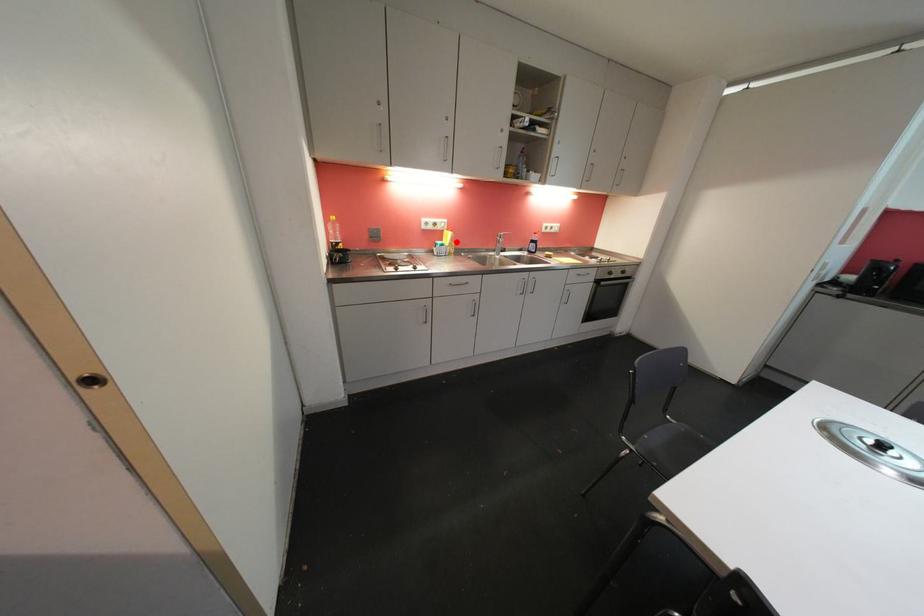
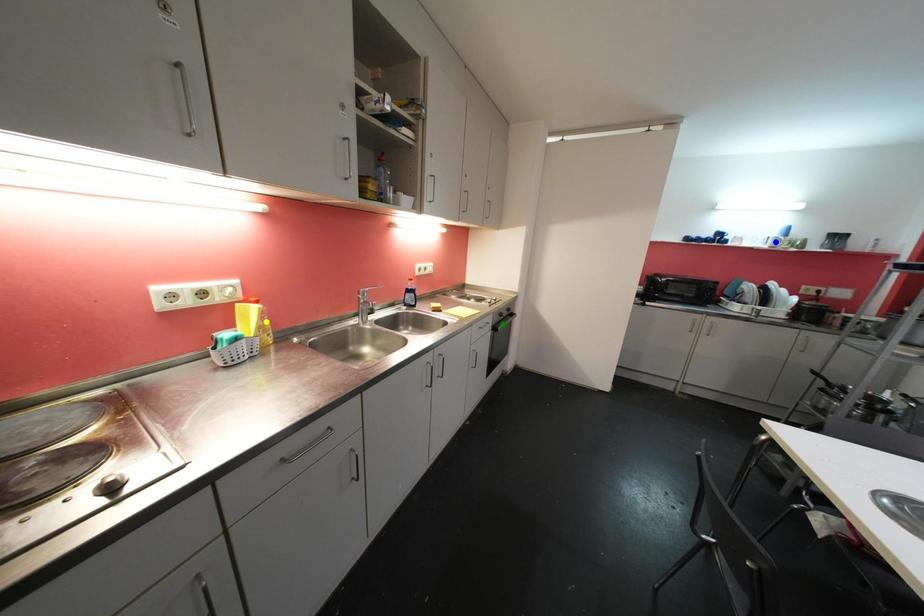
Question: I am providing you with two images of the same scene from different viewpoints. A red point is marked on the first image. You are given multiple points on the second image. Can you choose the point in image 2 that corresponds to the point in image 1?

Choices:
 (A) green point
 (B) yellow point
 (C) blue point

Answer: (B)